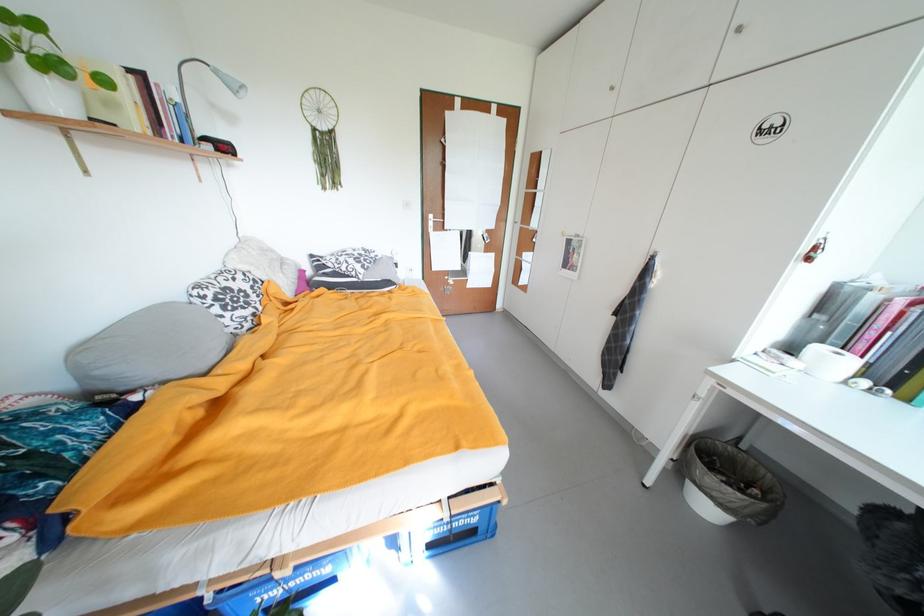
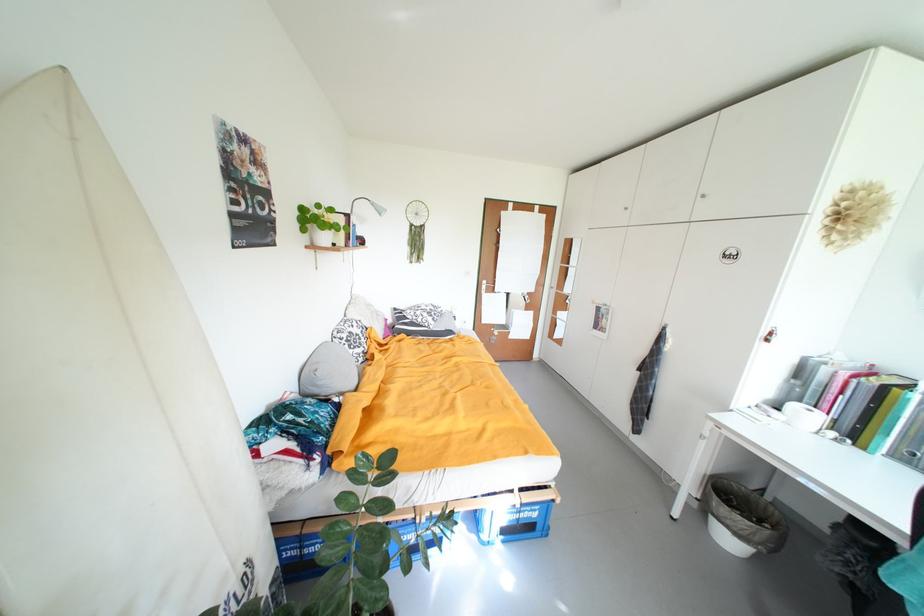
Locate, in the second image, the point that corresponds to [105,374] in the first image.

(326, 385)